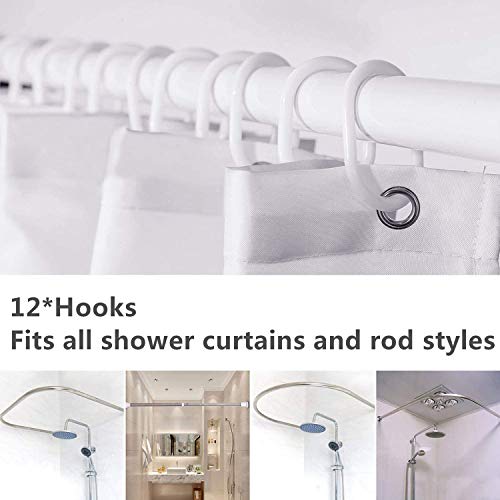
I want to click on hook, so [92, 94].